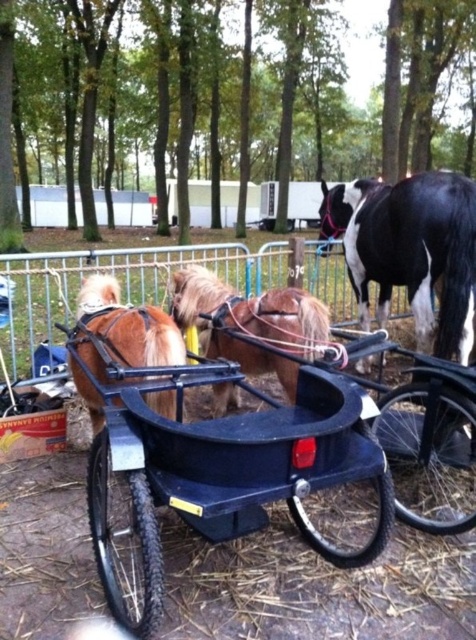
You are a farmer who needs to attach a 30 inch long rope to both the black plastic cart at center and the shiny brown pony at center. Will the rope be long enough to allow the pony to move freely around the cart?

The distance between the black plastic cart at center and the shiny brown pony at center is 35.34 inches. Since the rope is only 30 inches long, it will not be long enough to allow the pony to move freely around the cart.

You are holding a camera and want to take a photo of the black plastic cart at center. If you are standing 5.35 feet away from the cart, which object should you focus on to ensure the cart is in sharp focus?

You should focus on the black plastic cart at center since it is exactly 5.35 feet away from the camera, ensuring it will be in sharp focus.

You are a farmer who wants to choose a taller animal to pull a heavy load. Based on the scene, which animal between the black and white textured horse at center and the shiny brown pony at center would you select?

The shiny brown pony at center is taller than the black and white textured horse at center, so you should choose the shiny brown pony at center to pull the heavy load.